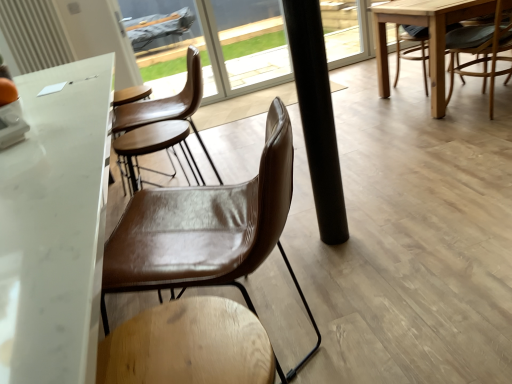
The image size is (512, 384). I want to click on brown leather chair at center, which is counted as the 2th chair, starting from the back, so click(197, 260).

Describe the element at coordinates (197, 260) in the screenshot. I see `brown leather chair at center, the 1th chair positioned from the bottom` at that location.

Describe the element at coordinates (317, 116) in the screenshot. The width and height of the screenshot is (512, 384). I see `black matte pole at center` at that location.

Identify the location of brown leather chair at center, which is counted as the 2th chair, starting from the back. (197, 260).

In the image, there is a brown leather chair at center, the 1th chair when ordered from front to back. In order to click on table above it (from the image's perspective) in this screenshot , I will do `click(55, 225)`.

Is white marble table at center in front of brown leather chair at center, the 1th chair positioned from the bottom?

That is True.

Is white marble table at center bigger than brown leather chair at center, which is counted as the 2th chair, starting from the back?

Correct, white marble table at center is larger in size than brown leather chair at center, which is counted as the 2th chair, starting from the back.

Does white marble table at center appear on the left side of brown leather chair at center, which appears as the first chair when viewed from the left?

Yes.

Is brown leather chair at center, the 2th chair viewed from the right, looking in the opposite direction of brown leather chair at right, which appears as the first chair when viewed from the back?

brown leather chair at center, the 2th chair viewed from the right, does not have its back to brown leather chair at right, which appears as the first chair when viewed from the back.

Does brown leather chair at center, placed as the second chair when sorted from top to bottom, come behind brown leather chair at right, placed as the second chair when sorted from left to right?

No, it is not.

From their relative heights in the image, would you say brown leather chair at center, which appears as the first chair when viewed from the left, is taller or shorter than brown leather chair at right, placed as the second chair when sorted from left to right?

Clearly, brown leather chair at center, which appears as the first chair when viewed from the left, is taller compared to brown leather chair at right, placed as the second chair when sorted from left to right.

Is brown leather chair at right, acting as the 2th chair starting from the front, not inside brown leather chair at center, placed as the second chair when sorted from top to bottom?

That's correct, brown leather chair at right, acting as the 2th chair starting from the front, is outside of brown leather chair at center, placed as the second chair when sorted from top to bottom.

How different are the orientations of brown leather chair at right, placed as the second chair when sorted from left to right, and brown leather chair at center, which appears as the first chair when viewed from the left, in degrees?

brown leather chair at right, placed as the second chair when sorted from left to right, and brown leather chair at center, which appears as the first chair when viewed from the left, are facing 84.8 degrees away from each other.

Is brown leather chair at right, placed as the 1th chair when sorted from top to bottom, far from brown leather chair at center, which appears as the first chair when viewed from the left?

Yes, brown leather chair at right, placed as the 1th chair when sorted from top to bottom, and brown leather chair at center, which appears as the first chair when viewed from the left, are located far from each other.

Relative to brown leather chair at center, the 1th chair when ordered from front to back, is brown leather chair at right, acting as the second chair starting from the bottom, in front or behind?

In the image, brown leather chair at right, acting as the second chair starting from the bottom, appears behind brown leather chair at center, the 1th chair when ordered from front to back.

Is black matte pole at center looking in the opposite direction of brown leather chair at center, the 1th chair when ordered from front to back?

No.

Can you tell me how much black matte pole at center and brown leather chair at center, which is counted as the 2th chair, starting from the back, differ in facing direction?

81.6 degrees.

Would you say black matte pole at center is outside brown leather chair at center, which is counted as the 2th chair, starting from the back?

Yes, black matte pole at center is outside of brown leather chair at center, which is counted as the 2th chair, starting from the back.

Between brown leather chair at right, acting as the 2th chair starting from the front, and black matte pole at center, which one has larger width?

brown leather chair at right, acting as the 2th chair starting from the front, is wider.

Where is `chair above the black matte pole at center (from the image's perspective)`? The height and width of the screenshot is (384, 512). chair above the black matte pole at center (from the image's perspective) is located at coordinates (481, 45).

Based on their sizes in the image, would you say brown leather chair at right, acting as the 2th chair starting from the front, is bigger or smaller than black matte pole at center?

In the image, brown leather chair at right, acting as the 2th chair starting from the front, appears to be larger than black matte pole at center.

How many degrees apart are the facing directions of brown leather chair at right, which is counted as the first chair, starting from the right, and white marble table at center?

brown leather chair at right, which is counted as the first chair, starting from the right, and white marble table at center are facing 88.3 degrees away from each other.

From the picture: From a real-world perspective, is brown leather chair at right, placed as the 1th chair when sorted from top to bottom, located higher than white marble table at center?

No, from a real-world perspective, brown leather chair at right, placed as the 1th chair when sorted from top to bottom, is not on top of white marble table at center.

Between point (497, 7) and point (70, 144), which one is positioned in front?

The point (70, 144) is closer to the camera.

Considering the relative sizes of white marble table at center and brown leather chair at right, which is counted as the first chair, starting from the right, in the image provided, is white marble table at center smaller than brown leather chair at right, which is counted as the first chair, starting from the right,?

Incorrect, white marble table at center is not smaller in size than brown leather chair at right, which is counted as the first chair, starting from the right.

From the white marble table at center, count 2nd chair to the right and point to it. Please provide its 2D coordinates.

[(481, 45)]

From a real-world perspective, is white marble table at center physically below brown leather chair at right, acting as the 2th chair starting from the front?

No, from a real-world perspective, white marble table at center is not below brown leather chair at right, acting as the 2th chair starting from the front.

Could you tell me if white marble table at center is turned towards brown leather chair at right, which appears as the first chair when viewed from the back?

Yes.

The width and height of the screenshot is (512, 384). What are the coordinates of `the 1st chair positioned below the white marble table at center (from a real-world perspective)` in the screenshot? It's located at (197, 260).

In order to click on chair to the right of brown leather chair at center, which appears as the first chair when viewed from the left in this screenshot , I will do `click(481, 45)`.

Estimate the real-world distances between objects in this image. Which object is closer to brown leather chair at right, acting as the 2th chair starting from the front, black matte pole at center or brown leather chair at center, the 1th chair positioned from the bottom?

Among the two, black matte pole at center is located nearer to brown leather chair at right, acting as the 2th chair starting from the front.

Looking at the image, which one is located closer to white marble table at center, brown leather chair at right, which appears as the first chair when viewed from the back, or brown leather chair at center, placed as the second chair when sorted from top to bottom?

brown leather chair at center, placed as the second chair when sorted from top to bottom, is positioned closer to the anchor white marble table at center.

Looking at the image, which one is located further to brown leather chair at right, acting as the 2th chair starting from the front, white marble table at center or black matte pole at center?

The object further to brown leather chair at right, acting as the 2th chair starting from the front, is white marble table at center.

When comparing their distances from black matte pole at center, does white marble table at center or brown leather chair at right, acting as the second chair starting from the bottom, seem further?

The object further to black matte pole at center is brown leather chair at right, acting as the second chair starting from the bottom.

Based on their spatial positions, is brown leather chair at right, placed as the second chair when sorted from left to right, or black matte pole at center closer to white marble table at center?

black matte pole at center is closer to white marble table at center.

From the image, which object appears to be farther from brown leather chair at center, the 2th chair viewed from the right, brown leather chair at right, acting as the second chair starting from the bottom, or white marble table at center?

The object further to brown leather chair at center, the 2th chair viewed from the right, is brown leather chair at right, acting as the second chair starting from the bottom.

In the scene shown: Which object lies further to the anchor point white marble table at center, brown leather chair at center, the 1th chair when ordered from front to back, or brown leather chair at right, placed as the 1th chair when sorted from top to bottom?

Among the two, brown leather chair at right, placed as the 1th chair when sorted from top to bottom, is located further to white marble table at center.

Looking at this image, from the image, which object appears to be farther from black matte pole at center, brown leather chair at right, placed as the 1th chair when sorted from top to bottom, or brown leather chair at center, which appears as the first chair when viewed from the left?

brown leather chair at right, placed as the 1th chair when sorted from top to bottom, is positioned further to the anchor black matte pole at center.

Where is `chair between white marble table at center and black matte pole at center in the front-back direction`? The image size is (512, 384). chair between white marble table at center and black matte pole at center in the front-back direction is located at coordinates click(x=197, y=260).

The width and height of the screenshot is (512, 384). I want to click on pillar between brown leather chair at center, the 2th chair viewed from the right, and brown leather chair at right, acting as the 2th chair starting from the front, from front to back, so click(x=317, y=116).

Where is `pillar located between white marble table at center and brown leather chair at right, which appears as the first chair when viewed from the back, in the left-right direction`? This screenshot has width=512, height=384. pillar located between white marble table at center and brown leather chair at right, which appears as the first chair when viewed from the back, in the left-right direction is located at coordinates (317, 116).

Locate an element on the screen. Image resolution: width=512 pixels, height=384 pixels. chair between white marble table at center and brown leather chair at right, placed as the second chair when sorted from left to right, from left to right is located at coordinates (197, 260).